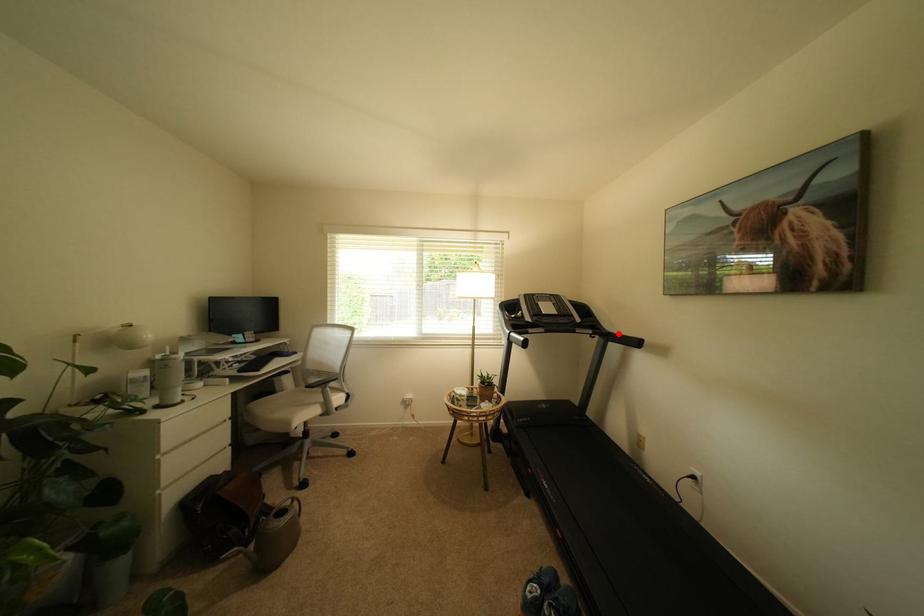
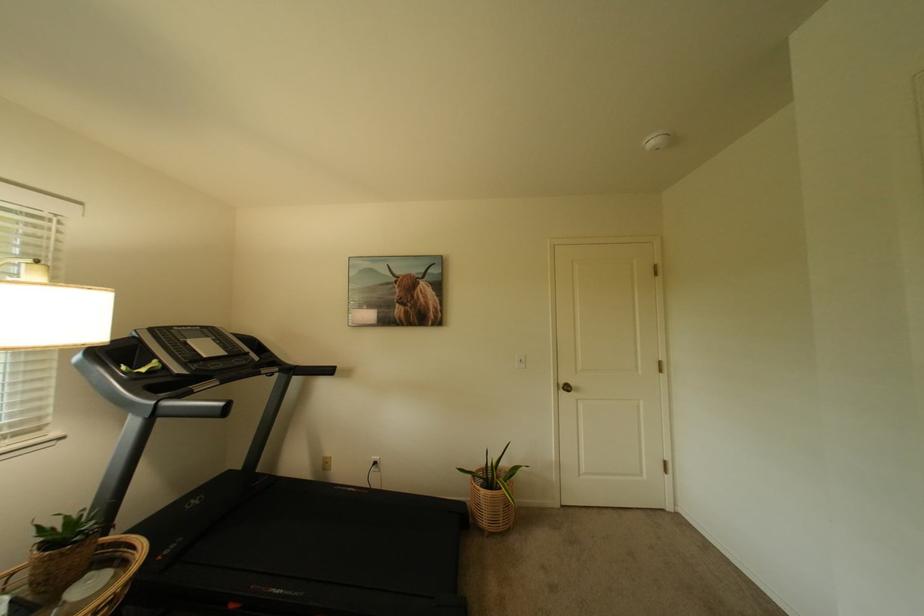
In the second image, find the point that corresponds to the highlighted location in the first image.

(305, 368)